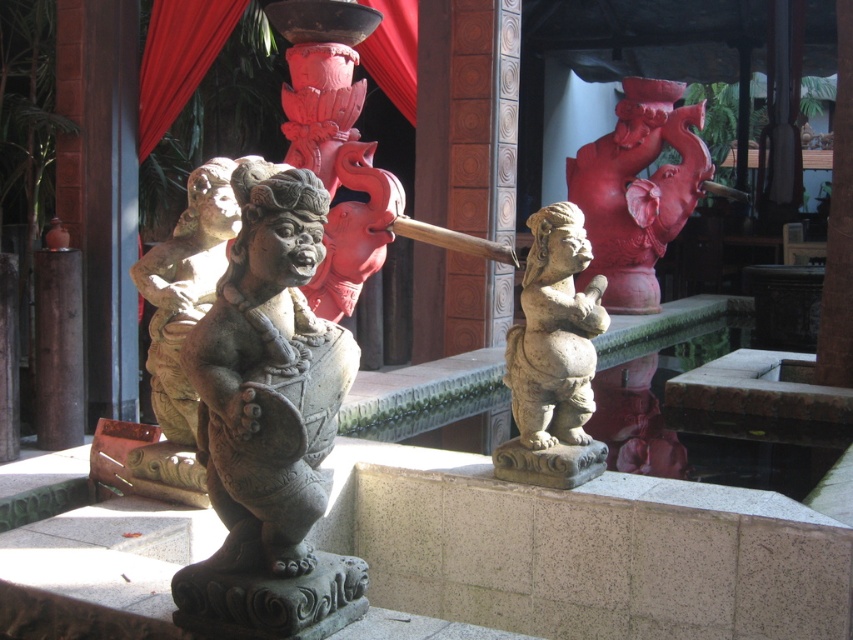
Question: Which of the following is the closest to the observer?

Choices:
 (A) gray stone statue at center
 (B) stone statue at center

Answer: (A)

Question: Can you confirm if gray stone statue at center is smaller than stone statue at center?

Choices:
 (A) no
 (B) yes

Answer: (A)

Question: Is gray stone statue at center bigger than stone statue at center?

Choices:
 (A) yes
 (B) no

Answer: (A)

Question: Considering the relative positions of gray stone statue at center and stone statue at center in the image provided, where is gray stone statue at center located with respect to stone statue at center?

Choices:
 (A) left
 (B) right

Answer: (A)